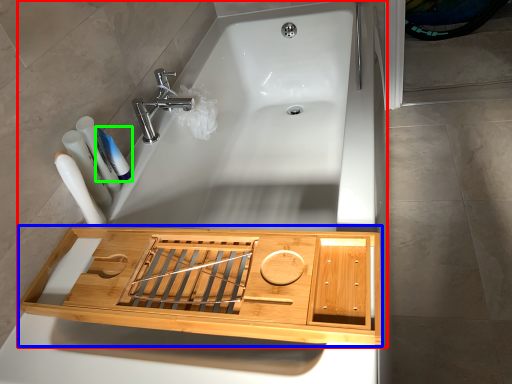
Question: Based on their relative distances, which object is nearer to bath (highlighted by a red box)? Choose from cabinetry (highlighted by a blue box) and toothpaste (highlighted by a green box).

Choices:
 (A) cabinetry
 (B) toothpaste

Answer: (A)